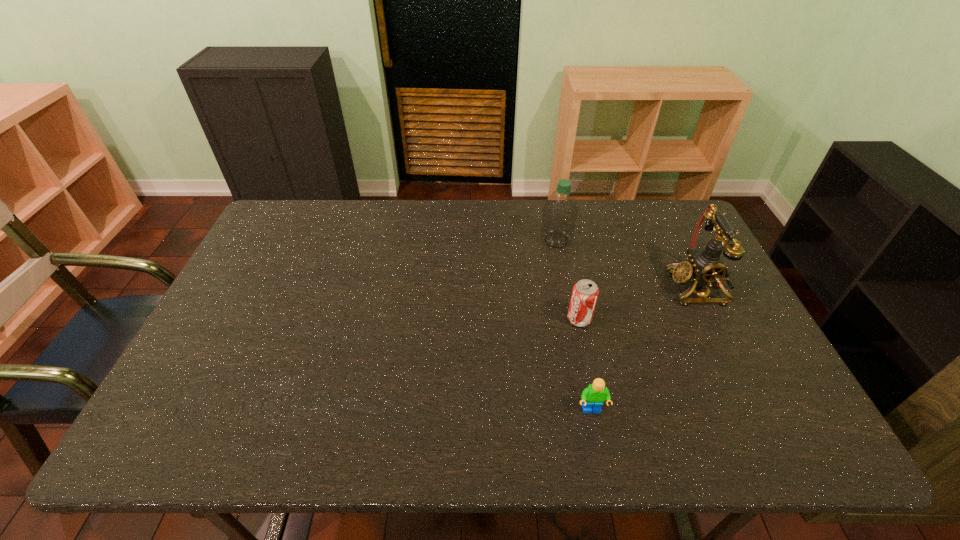
The image size is (960, 540). I want to click on telephone, so click(705, 267).

Identify the location of the farthest object. (560, 211).

The width and height of the screenshot is (960, 540). I want to click on soda can, so click(585, 293).

Locate an element on the screen. the nearest object is located at coordinates (592, 397).

At what (x,y) coordinates should I click in order to perform the action: click on Lego. Please return your answer as a coordinate pair (x, y). The image size is (960, 540). Looking at the image, I should click on (592, 397).

This screenshot has width=960, height=540. What are the coordinates of `vacant space situated 0.110m on the front of the rightmost object, featuring the rotary dial` in the screenshot? It's located at (631, 287).

Locate an element on the screen. This screenshot has height=540, width=960. free space located on the front of the rightmost object, featuring the rotary dial is located at coordinates (644, 287).

Where is `vacant position located 0.180m on the front of the rightmost object, featuring the rotary dial`? The height and width of the screenshot is (540, 960). vacant position located 0.180m on the front of the rightmost object, featuring the rotary dial is located at coordinates (607, 287).

Identify the location of free location located on the right of the farthest object. This screenshot has height=540, width=960. (642, 240).

The image size is (960, 540). Find the location of `free space located 0.140m on the front of the soda can`. free space located 0.140m on the front of the soda can is located at coordinates (590, 373).